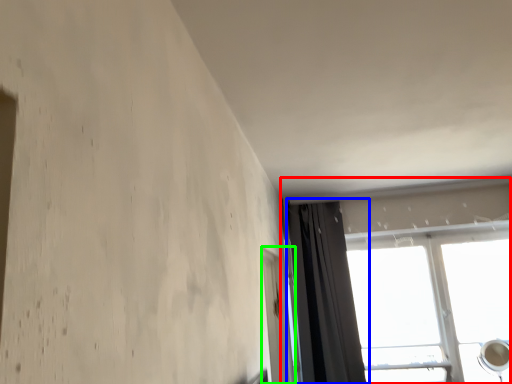
Question: Which object is the closest to the window (highlighted by a red box)? Choose among these: curtain (highlighted by a blue box) or screen door (highlighted by a green box).

Choices:
 (A) curtain
 (B) screen door

Answer: (A)